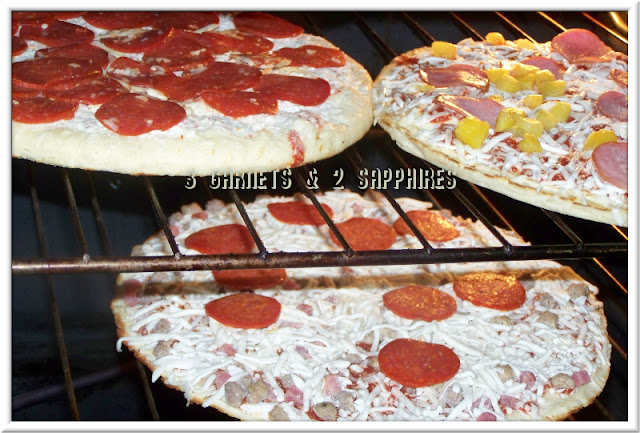
Image resolution: width=640 pixels, height=433 pixels. What are the coordinates of `top oven rack` in the screenshot? It's located at (x=356, y=263), (x=127, y=265), (x=592, y=252).